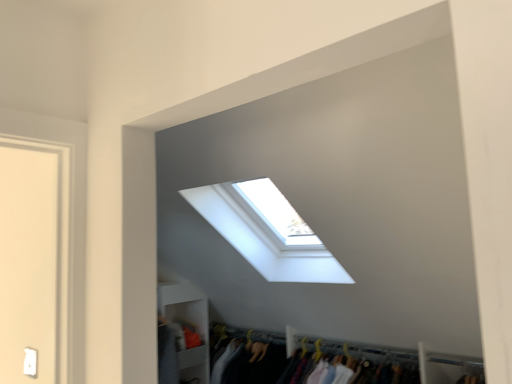
Question: Is transparent glass window at upper center taller or shorter than white matte shelf at lower left?

Choices:
 (A) tall
 (B) short

Answer: (B)

Question: Is transparent glass window at upper center wider or thinner than white matte shelf at lower left?

Choices:
 (A) wide
 (B) thin

Answer: (A)

Question: Is transparent glass window at upper center situated inside white matte shelf at lower left or outside?

Choices:
 (A) inside
 (B) outside

Answer: (B)

Question: Considering the positions of white matte shelf at lower left and transparent glass window at upper center in the image, is white matte shelf at lower left bigger or smaller than transparent glass window at upper center?

Choices:
 (A) small
 (B) big

Answer: (A)

Question: Considering the positions of white matte shelf at lower left and transparent glass window at upper center in the image, is white matte shelf at lower left wider or thinner than transparent glass window at upper center?

Choices:
 (A) wide
 (B) thin

Answer: (B)

Question: Is point (200, 337) closer or farther from the camera than point (225, 223)?

Choices:
 (A) closer
 (B) farther

Answer: (B)

Question: From the image's perspective, relative to transparent glass window at upper center, is white matte shelf at lower left above or below?

Choices:
 (A) above
 (B) below

Answer: (B)